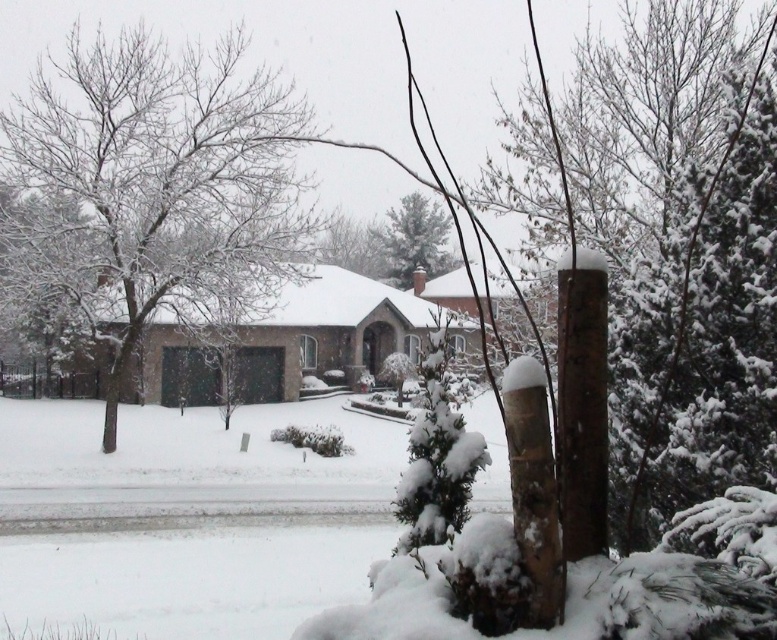
Question: Estimate the real-world distances between objects in this image. Which object is farther from the snow-covered tree at left?

Choices:
 (A) white fluffy snow at center
 (B) green textured pine tree at center

Answer: (A)

Question: Which object is farther from the camera taking this photo?

Choices:
 (A) snow-covered tree at left
 (B) green textured pine tree at center
 (C) brown rough wood pole at right

Answer: (B)

Question: Is snow-covered tree at left to the right of white fluffy snow at center from the viewer's perspective?

Choices:
 (A) no
 (B) yes

Answer: (A)

Question: Does snow-covered tree at left appear under white fluffy snow at center?

Choices:
 (A) no
 (B) yes

Answer: (A)

Question: Which point is closer to the camera?

Choices:
 (A) green textured pine tree at center
 (B) snow-covered evergreen at center-right
 (C) brown rough wood pole at right

Answer: (C)

Question: Is snow-covered evergreen at center-right below brown rough wood pole at right?

Choices:
 (A) yes
 (B) no

Answer: (B)